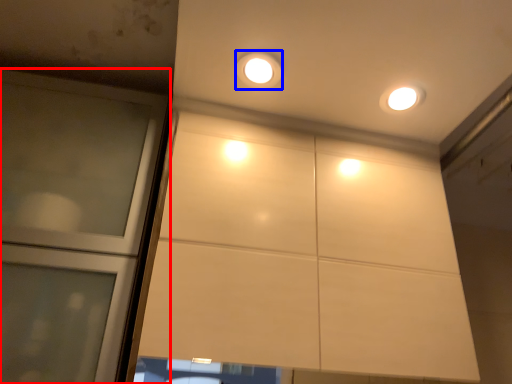
Question: Among these objects, which one is farthest to the camera, door (highlighted by a red box) or dot (highlighted by a blue box)?

Choices:
 (A) door
 (B) dot

Answer: (B)